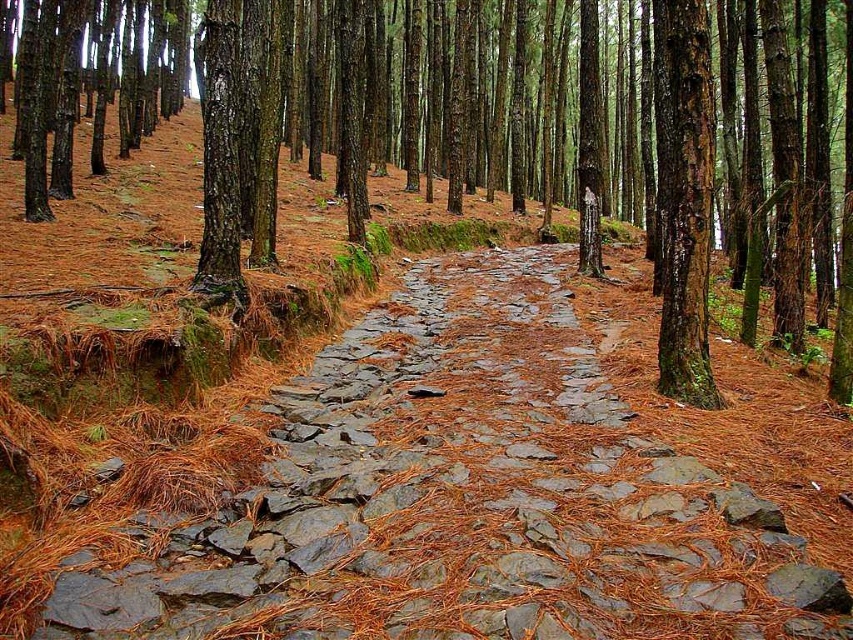
You are standing at the entrance of the forest and see the gray stone path at center. If you walk straight ahead, will you stay on the path?

Yes, because the gray stone path at center is located at point (467,499), which is directly in front of you, so walking straight ahead will keep you on the path.